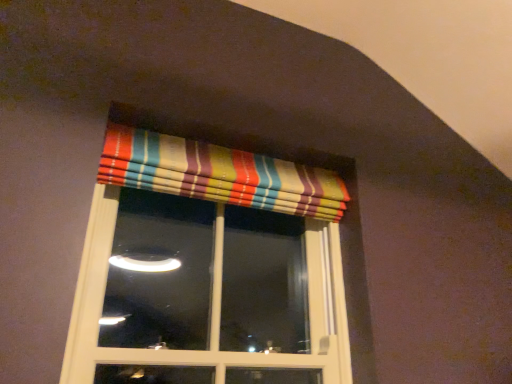
The width and height of the screenshot is (512, 384). What do you see at coordinates (220, 174) in the screenshot?
I see `striped fabric curtain at upper center` at bounding box center [220, 174].

Measure the distance between point (266,169) and camera.

A distance of 5.20 feet exists between point (266,169) and camera.

What are the coordinates of `striped fabric curtain at upper center` in the screenshot? It's located at (220, 174).

Measure the distance between striped fabric curtain at upper center and camera.

4.43 feet.

Identify the location of striped fabric valance at upper center. The width and height of the screenshot is (512, 384). (208, 268).

What do you see at coordinates (208, 268) in the screenshot? This screenshot has height=384, width=512. I see `striped fabric valance at upper center` at bounding box center [208, 268].

The width and height of the screenshot is (512, 384). I want to click on striped fabric curtain at upper center, so click(220, 174).

Which is more to the right, striped fabric valance at upper center or striped fabric curtain at upper center?

From the viewer's perspective, striped fabric curtain at upper center appears more on the right side.

Is the depth of striped fabric valance at upper center less than that of striped fabric curtain at upper center?

That is True.

Is point (312, 176) less distant than point (157, 144)?

No, (312, 176) is further to viewer.

From the image's perspective, between striped fabric valance at upper center and striped fabric curtain at upper center, who is located below?

striped fabric valance at upper center is shown below in the image.

Looking at this image, from a real-world perspective, is striped fabric valance at upper center below striped fabric curtain at upper center?

Indeed, from a real-world perspective, striped fabric valance at upper center is positioned beneath striped fabric curtain at upper center.

Considering the relative sizes of striped fabric valance at upper center and striped fabric curtain at upper center in the image provided, is striped fabric valance at upper center thinner than striped fabric curtain at upper center?

No.

In terms of height, does striped fabric valance at upper center look taller or shorter compared to striped fabric curtain at upper center?

striped fabric valance at upper center is taller than striped fabric curtain at upper center.

Considering the relative sizes of striped fabric valance at upper center and striped fabric curtain at upper center in the image provided, is striped fabric valance at upper center smaller than striped fabric curtain at upper center?

Incorrect, striped fabric valance at upper center is not smaller in size than striped fabric curtain at upper center.

Is striped fabric valance at upper center outside of striped fabric curtain at upper center?

Absolutely, striped fabric valance at upper center is external to striped fabric curtain at upper center.

Is striped fabric valance at upper center not near striped fabric curtain at upper center?

Yes, striped fabric valance at upper center is far from striped fabric curtain at upper center.

Is striped fabric valance at upper center oriented towards striped fabric curtain at upper center?

Yes, striped fabric valance at upper center faces towards striped fabric curtain at upper center.

How different are the orientations of striped fabric valance at upper center and striped fabric curtain at upper center in degrees?

They differ by 0.000552 degrees in their facing directions.

Identify the location of window below the striped fabric curtain at upper center (from the image's perspective). This screenshot has width=512, height=384. (208, 268).

Considering the relative positions of striped fabric curtain at upper center and striped fabric valance at upper center in the image provided, is striped fabric curtain at upper center to the left of striped fabric valance at upper center from the viewer's perspective?

No.

In the image, is striped fabric curtain at upper center positioned in front of or behind striped fabric valance at upper center?

striped fabric curtain at upper center is positioned farther from the viewer than striped fabric valance at upper center.

Is point (136, 178) less distant than point (278, 236)?

Yes, point (136, 178) is in front of point (278, 236).

Based on the photo, from the image's perspective, between striped fabric curtain at upper center and striped fabric valance at upper center, who is located below?

striped fabric valance at upper center, from the image's perspective.

From a real-world perspective, who is located lower, striped fabric curtain at upper center or striped fabric valance at upper center?

In real-world perspective, striped fabric valance at upper center is lower.

Is striped fabric curtain at upper center thinner than striped fabric valance at upper center?

Correct, the width of striped fabric curtain at upper center is less than that of striped fabric valance at upper center.

Does striped fabric curtain at upper center have a greater height compared to striped fabric valance at upper center?

No.

Does striped fabric curtain at upper center have a larger size compared to striped fabric valance at upper center?

Actually, striped fabric curtain at upper center might be smaller than striped fabric valance at upper center.

Is striped fabric curtain at upper center not inside striped fabric valance at upper center?

Absolutely, striped fabric curtain at upper center is external to striped fabric valance at upper center.

Are striped fabric curtain at upper center and striped fabric valance at upper center far apart?

That's right, there is a large distance between striped fabric curtain at upper center and striped fabric valance at upper center.

Consider the image. Does striped fabric curtain at upper center turn towards striped fabric valance at upper center?

No, striped fabric curtain at upper center is not turned towards striped fabric valance at upper center.

How many degrees apart are the facing directions of striped fabric curtain at upper center and striped fabric valance at upper center?

The facing directions of striped fabric curtain at upper center and striped fabric valance at upper center are 0.000552 degrees apart.

Find the location of `window located in front of the striped fabric curtain at upper center`. window located in front of the striped fabric curtain at upper center is located at coordinates (208, 268).

In order to click on curtain behind the striped fabric valance at upper center in this screenshot , I will do `click(220, 174)`.

Locate an element on the screen. This screenshot has width=512, height=384. window in front of the striped fabric curtain at upper center is located at coordinates (208, 268).